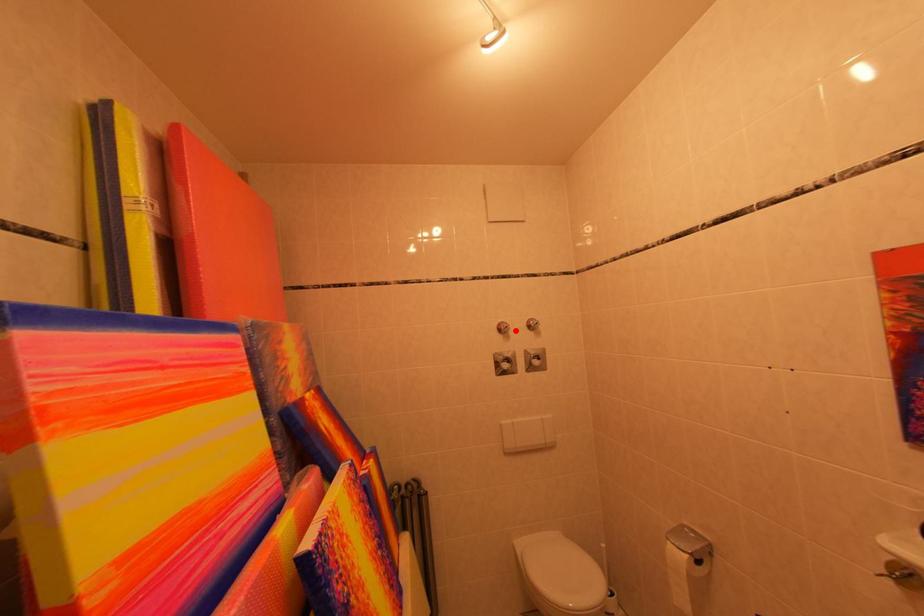
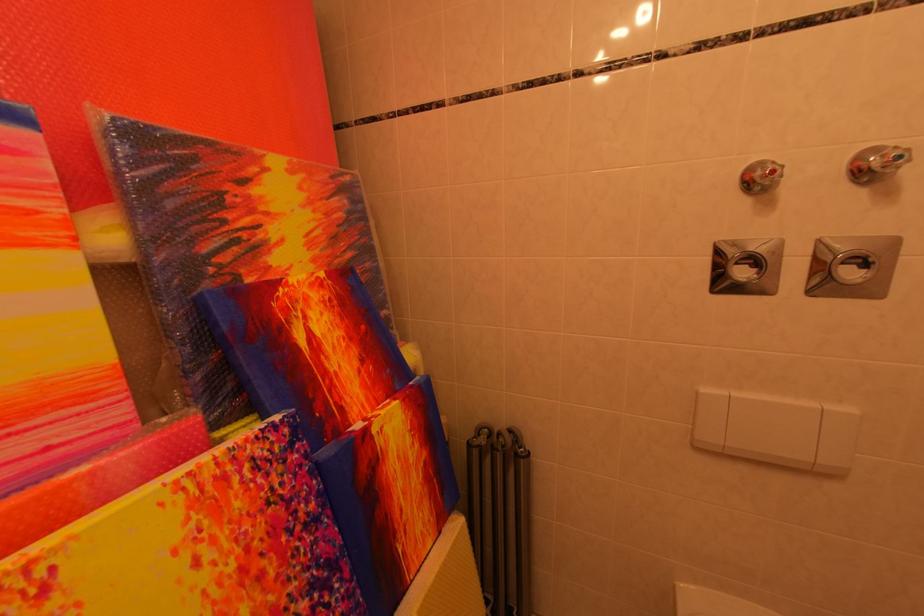
Where in the second image is the point corresponding to the highlighted location from the first image?

(782, 176)